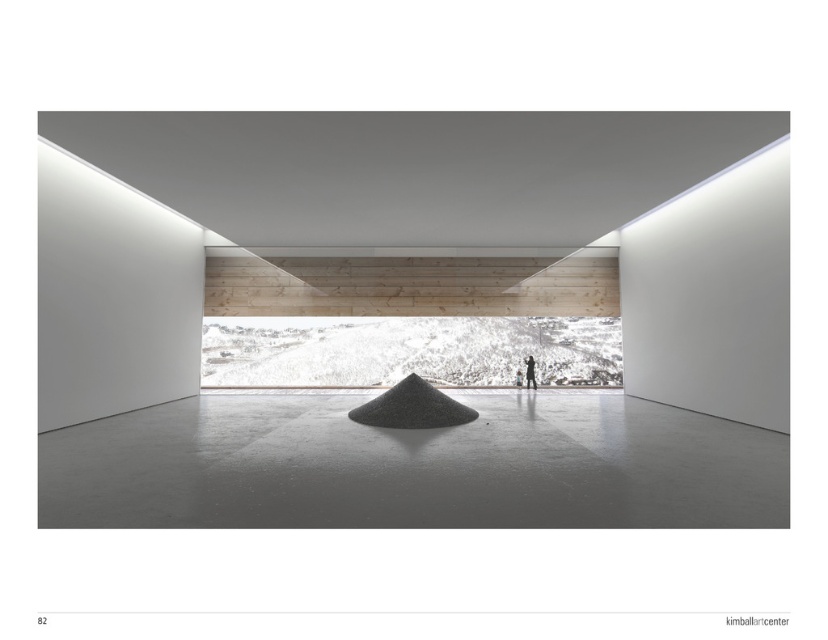
Is gray polished concrete at center shorter than matte black figure at center?

Indeed, gray polished concrete at center has a lesser height compared to matte black figure at center.

What are the coordinates of `gray polished concrete at center` in the screenshot? It's located at (414, 467).

Is point (214, 492) farther from camera compared to point (525, 365)?

That is False.

What are the coordinates of `gray polished concrete at center` in the screenshot? It's located at (414, 467).

Can you confirm if gray polished concrete at center is bigger than black gravel mound at center?

Incorrect, gray polished concrete at center is not larger than black gravel mound at center.

Can you confirm if gray polished concrete at center is smaller than black gravel mound at center?

Correct, gray polished concrete at center occupies less space than black gravel mound at center.

Where is `gray polished concrete at center`? Image resolution: width=828 pixels, height=640 pixels. gray polished concrete at center is located at coordinates (414, 467).

Who is shorter, black gravel mound at center or matte black figure at center?

black gravel mound at center

Does point (414, 394) lie in front of point (528, 368)?

Yes, it is.

Between point (373, 426) and point (532, 368), which one is positioned behind?

Positioned behind is point (532, 368).

Where is `black gravel mound at center`? This screenshot has height=640, width=828. black gravel mound at center is located at coordinates (412, 406).